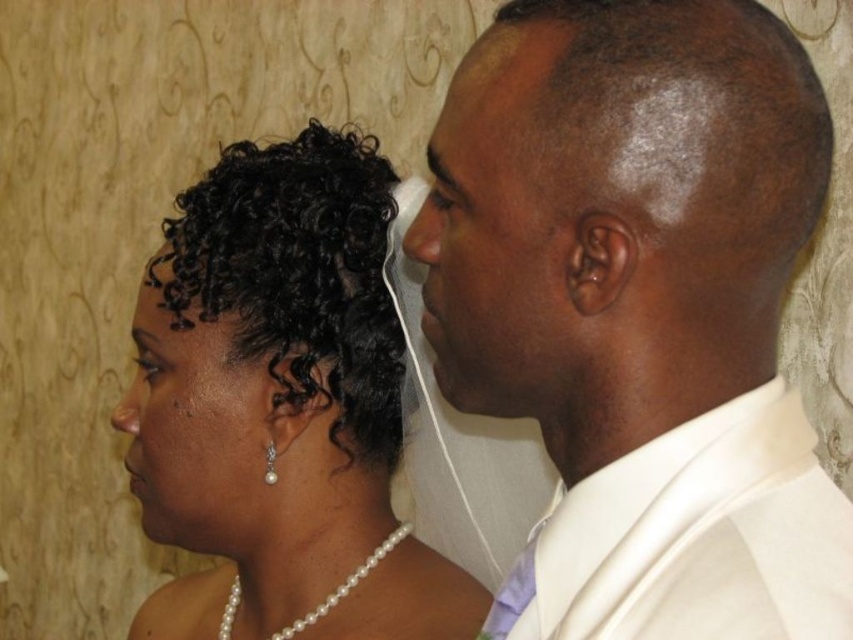
Question: Can you confirm if satin skin face at center is wider than black pearl earring at lower left?

Choices:
 (A) yes
 (B) no

Answer: (B)

Question: Which object is the farthest from the shiny white suit at right?

Choices:
 (A) black pearl earring at lower left
 (B) black pearl necklace at center

Answer: (A)

Question: Considering the real-world distances, which object is farthest from the satin skin face at center?

Choices:
 (A) black pearl earring at lower left
 (B) shiny white suit at right

Answer: (A)

Question: In this image, where is satin skin face at center located relative to black pearl earring at lower left?

Choices:
 (A) right
 (B) left

Answer: (A)

Question: Which object is farther from the camera taking this photo?

Choices:
 (A) shiny white suit at right
 (B) black pearl earring at lower left

Answer: (B)

Question: Does black pearl necklace at center come in front of black pearl earring at lower left?

Choices:
 (A) yes
 (B) no

Answer: (A)